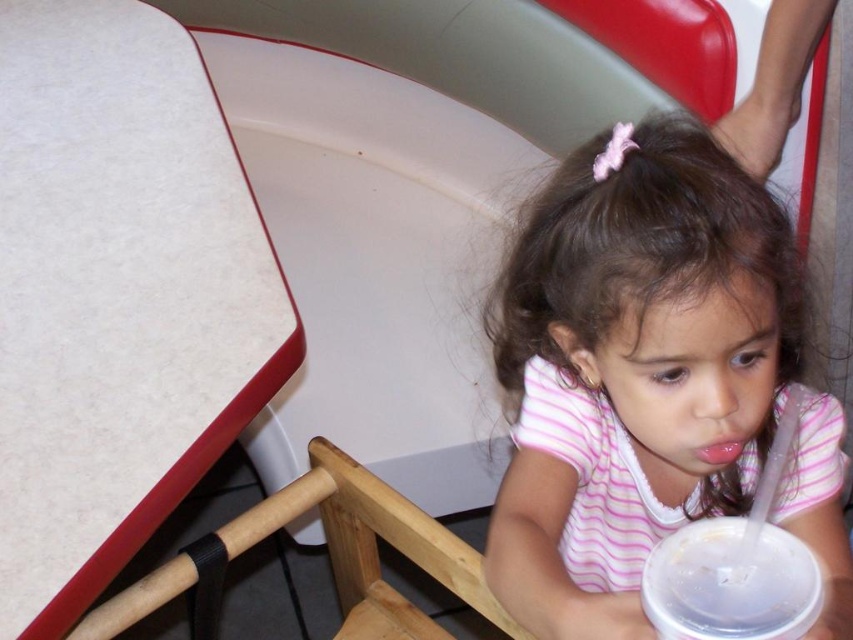
You are a customer at a fast food restaurant and want to place your clear plastic cup at lower right on the table. The wooden chair at lower center is currently in the way. Can you move the chair to make space?

The clear plastic cup at lower right is behind the wooden chair at lower center, so you can move the wooden chair at lower center out of the way to create space for placing the cup on the table.

You are a delivery person who needs to place a small package on the table. The package is 10 cm wide. Can the white laminate table at upper left accommodate the package next to the clear plastic cup at lower right?

The white laminate table at upper left might be wider than clear plastic cup at lower right, so it is possible that there is enough space to place the 10 cm wide package next to the clear plastic cup at lower right. However, without exact measurements, we cannot be certain.

You are a photographer trying to capture a candid shot of the girl in the pink striped shirt at center and the wooden chair at lower center. To ensure both are in frame, you need to know their relative positions. Which object is located to the right of the other?

The pink striped shirt at center is positioned on the right side of the wooden chair at lower center, so the pink striped shirt at center is to the right of the wooden chair at lower center.